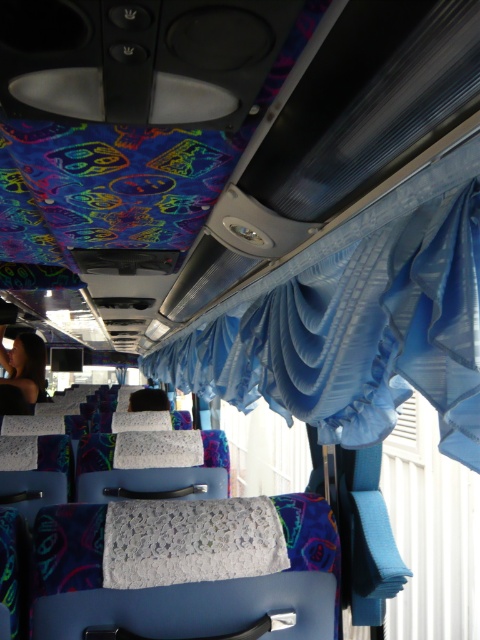
Consider the image. Does blue satin curtain at upper center have a lesser width compared to white lace cloth at center?

No.

Is blue satin curtain at upper center in front of white lace cloth at center?

Yes, blue satin curtain at upper center is in front of white lace cloth at center.

This screenshot has height=640, width=480. Find the location of `blue satin curtain at upper center`. blue satin curtain at upper center is located at coordinates (357, 333).

Consider the image. Is blue satin curtain at upper center above dark hair at left?

Indeed, blue satin curtain at upper center is positioned over dark hair at left.

From the picture: Can you confirm if blue satin curtain at upper center is wider than dark hair at left?

No.

Is point (168, 372) positioned after point (14, 349)?

That is True.

In order to click on blue satin curtain at upper center in this screenshot , I will do `click(357, 333)`.

Between white lace cloth at center and dark hair at left, which one appears on the right side from the viewer's perspective?

From the viewer's perspective, white lace cloth at center appears more on the right side.

Is white lace cloth at center in front of dark hair at left?

Yes, white lace cloth at center is closer to the viewer.

Does point (248, 548) come farther from viewer compared to point (44, 346)?

No.

Find the location of a particular element. white lace cloth at center is located at coordinates (191, 541).